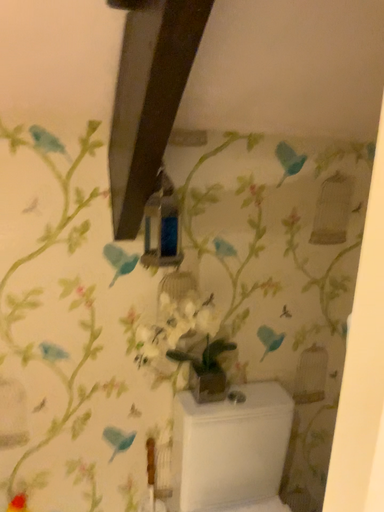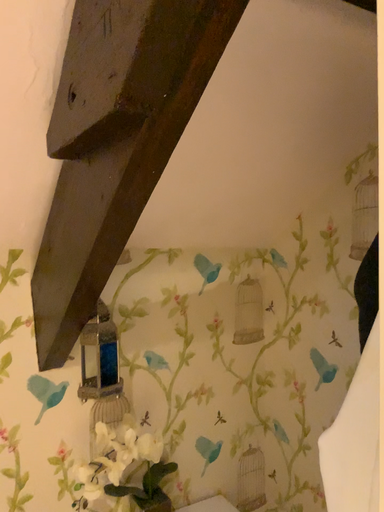
Question: How did the camera likely rotate when shooting the video?

Choices:
 (A) rotated downward
 (B) rotated upward

Answer: (B)